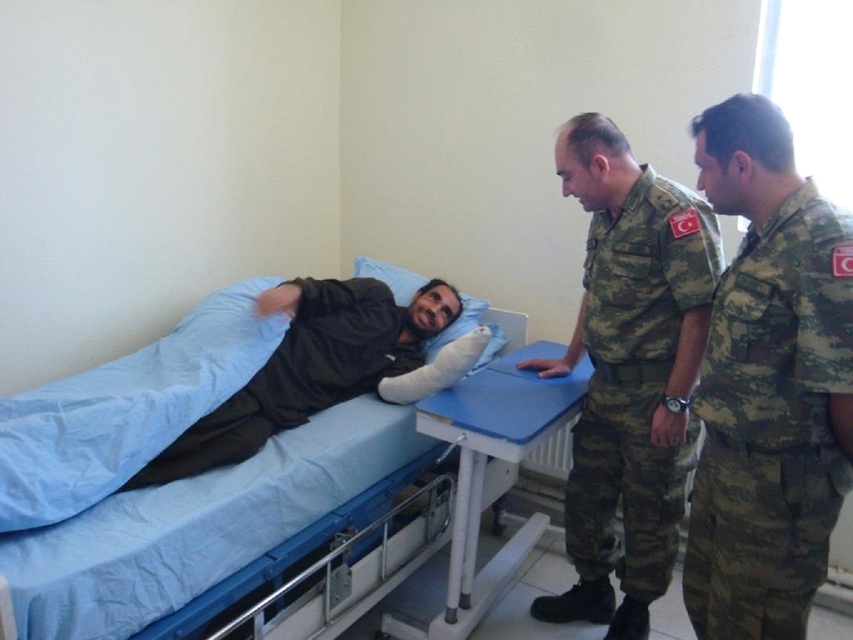
You are a nurse in the hospital. You need to take a photo of the blue fabric bed at center using a camera that requires a minimum distance of 1.2 meters to focus properly. Can you take the photo without moving either the bed or the camera?

The blue fabric bed at center and camera are 1.35 meters apart. Since the required minimum distance is 1.2 meters, the nurse can take the photo without moving either the bed or the camera because the distance is sufficient.

What is the exact coordinate of the camouflage uniform at center in the image?

The camouflage uniform at center is located at point (630, 372).